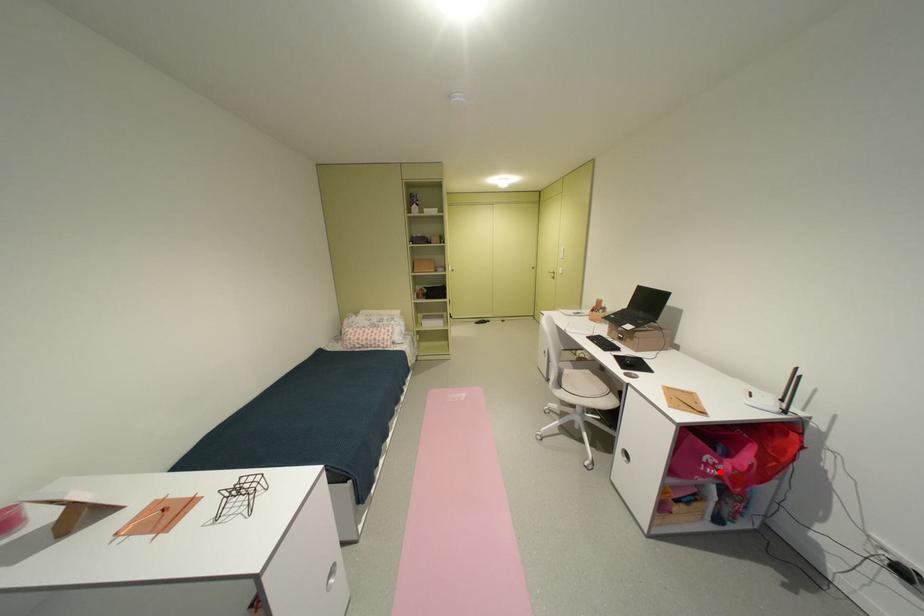
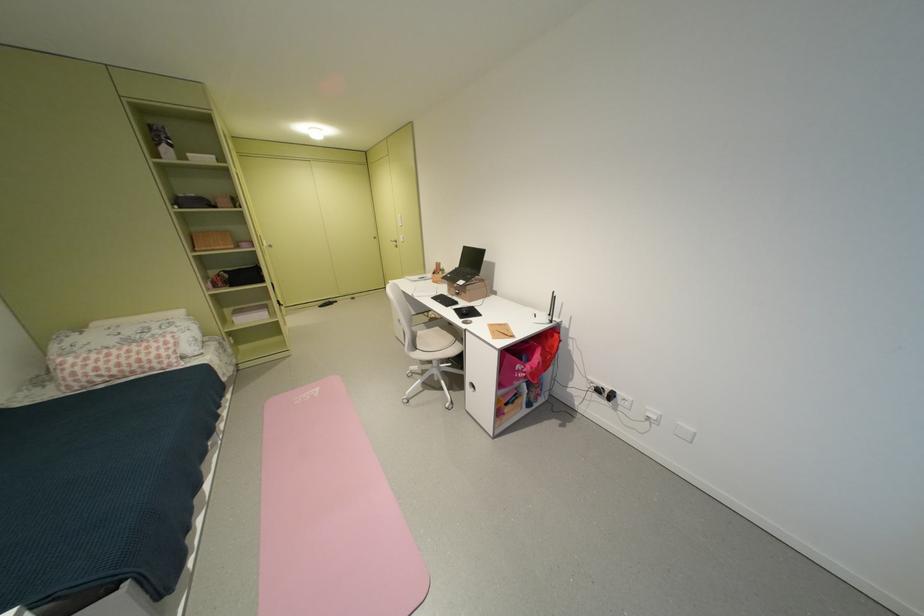
Find the pixel in the second image that matches the highlighted location in the first image.

(530, 376)